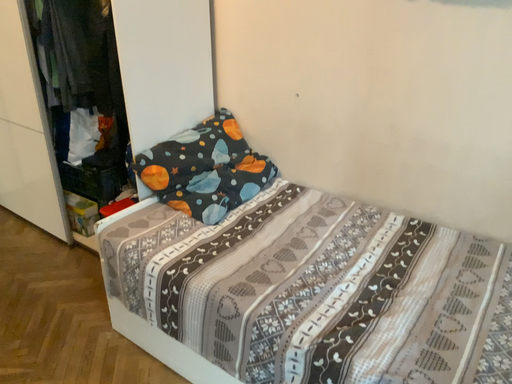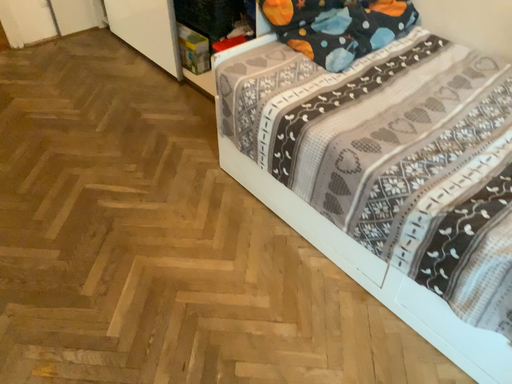
Question: How did the camera likely rotate when shooting the video?

Choices:
 (A) rotated right
 (B) rotated left

Answer: (B)